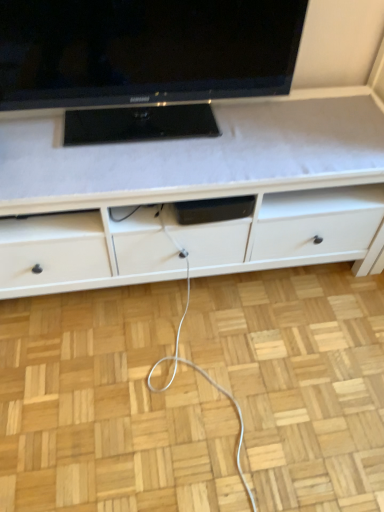
Image resolution: width=384 pixels, height=512 pixels. What do you see at coordinates (144, 61) in the screenshot?
I see `black glossy tv at upper center` at bounding box center [144, 61].

You are a GUI agent. You are given a task and a screenshot of the screen. Output one action in this format:
    pyautogui.click(x=<x>, y=<y>)
    Task: Click on the black glossy tv at upper center
    The height and width of the screenshot is (512, 384).
    Given the screenshot: What is the action you would take?
    pyautogui.click(x=144, y=61)

At what (x,y) coordinates should I click in order to perform the action: click on white matte cabinet at center. Please return your answer as a coordinate pair (x, y). The image size is (384, 512). Looking at the image, I should click on click(x=193, y=195).

Describe the element at coordinates (193, 195) in the screenshot. The width and height of the screenshot is (384, 512). I see `white matte cabinet at center` at that location.

Where is `black glossy tv at upper center`? This screenshot has width=384, height=512. black glossy tv at upper center is located at coordinates (144, 61).

Which is more to the right, black glossy tv at upper center or white matte cabinet at center?

From the viewer's perspective, white matte cabinet at center appears more on the right side.

Considering their positions, is black glossy tv at upper center located in front of or behind white matte cabinet at center?

black glossy tv at upper center is in front of white matte cabinet at center.

Is point (108, 127) closer to viewer compared to point (348, 120)?

Yes, point (108, 127) is closer to viewer.

From the image's perspective, is black glossy tv at upper center below white matte cabinet at center?

Incorrect, from the image's perspective, black glossy tv at upper center is higher than white matte cabinet at center.

From a real-world perspective, which is physically above, black glossy tv at upper center or white matte cabinet at center?

black glossy tv at upper center is physically above.

Which of these two, black glossy tv at upper center or white matte cabinet at center, is thinner?

Thinner between the two is black glossy tv at upper center.

Between black glossy tv at upper center and white matte cabinet at center, which one has more height?

white matte cabinet at center.

Based on their sizes in the image, would you say black glossy tv at upper center is bigger or smaller than white matte cabinet at center?

Considering their sizes, black glossy tv at upper center takes up less space than white matte cabinet at center.

Is black glossy tv at upper center inside or outside of white matte cabinet at center?

black glossy tv at upper center is spatially situated outside white matte cabinet at center.

Is black glossy tv at upper center with white matte cabinet at center?

They are not placed beside each other.

Is black glossy tv at upper center facing towards white matte cabinet at center?

No, black glossy tv at upper center is not facing towards white matte cabinet at center.

The height and width of the screenshot is (512, 384). Identify the location of cabinetry lying on the right of black glossy tv at upper center. (193, 195).

Consider the image. Considering the relative positions of white matte cabinet at center and black glossy tv at upper center in the image provided, is white matte cabinet at center to the left of black glossy tv at upper center from the viewer's perspective?

No.

Considering their positions, is white matte cabinet at center located in front of or behind black glossy tv at upper center?

Clearly, white matte cabinet at center is behind black glossy tv at upper center.

Is point (207, 192) closer to camera compared to point (190, 46)?

No, it is not.

From the image's perspective, which is above, white matte cabinet at center or black glossy tv at upper center?

black glossy tv at upper center is shown above in the image.

From a real-world perspective, between white matte cabinet at center and black glossy tv at upper center, who is vertically higher?

black glossy tv at upper center.

Is white matte cabinet at center thinner than black glossy tv at upper center?

No, white matte cabinet at center is not thinner than black glossy tv at upper center.

Who is taller, white matte cabinet at center or black glossy tv at upper center?

Standing taller between the two is white matte cabinet at center.

Based on their sizes in the image, would you say white matte cabinet at center is bigger or smaller than black glossy tv at upper center?

Considering their sizes, white matte cabinet at center takes up more space than black glossy tv at upper center.

Do you think white matte cabinet at center is within black glossy tv at upper center, or outside of it?

white matte cabinet at center is outside black glossy tv at upper center.

Is white matte cabinet at center far from black glossy tv at upper center?

Actually, white matte cabinet at center and black glossy tv at upper center are a little close together.

Is white matte cabinet at center oriented towards black glossy tv at upper center?

No, white matte cabinet at center does not turn towards black glossy tv at upper center.

Can you tell me how much white matte cabinet at center and black glossy tv at upper center differ in facing direction?

They differ by 0.719 degrees in their facing directions.

Where is `cabinetry behind the black glossy tv at upper center`? This screenshot has width=384, height=512. cabinetry behind the black glossy tv at upper center is located at coordinates (193, 195).

The image size is (384, 512). I want to click on television on the left of white matte cabinet at center, so click(x=144, y=61).

The image size is (384, 512). What are the coordinates of `television in front of the white matte cabinet at center` in the screenshot? It's located at (144, 61).